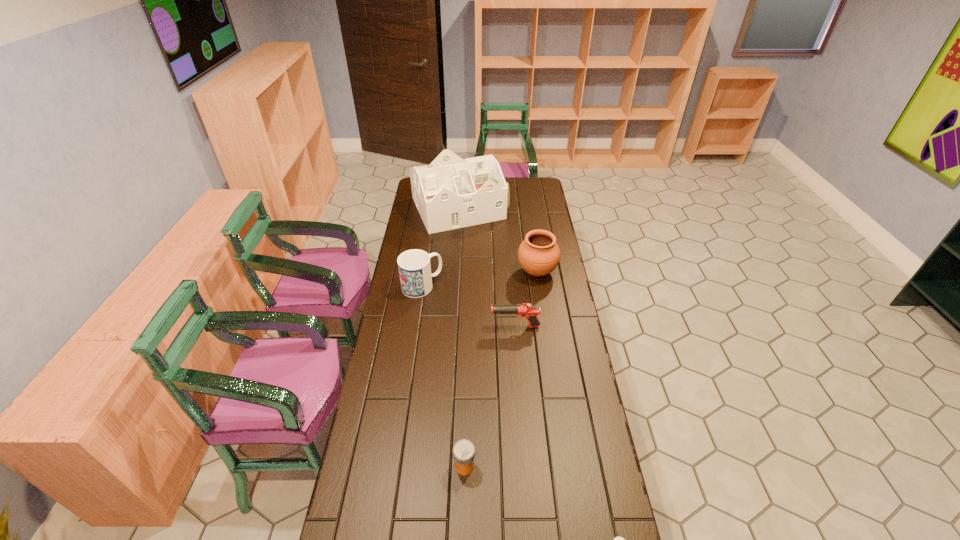
Choose which object is the third nearest neighbor to the tallest object. Please provide its 2D coordinates. Your answer should be formatted as a tuple, i.e. [(x, y)], where the tuple contains the x and y coordinates of a point satisfying the conditions above.

[(526, 310)]

Image resolution: width=960 pixels, height=540 pixels. In order to click on object that is the fifth closest to the left medicine in this screenshot , I will do `click(450, 193)`.

I want to click on free space that satisfies the following two spatial constraints: 1. on the back side of the pottery; 2. on the right side of the mug, so click(x=424, y=272).

You are a GUI agent. You are given a task and a screenshot of the screen. Output one action in this format:
    pyautogui.click(x=<x>, y=<y>)
    Task: Click on the vacant point that satisfies the following two spatial constraints: 1. on the front side of the second tallest object; 2. on the right side of the tallest object
    The height and width of the screenshot is (540, 960).
    Given the screenshot: What is the action you would take?
    pyautogui.click(x=455, y=272)